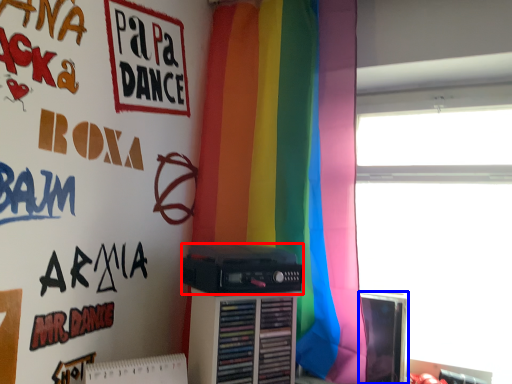
Question: Which of the following is the farthest to the observer, cassette (highlighted by a red box) or computer monitor (highlighted by a blue box)?

Choices:
 (A) cassette
 (B) computer monitor

Answer: (B)